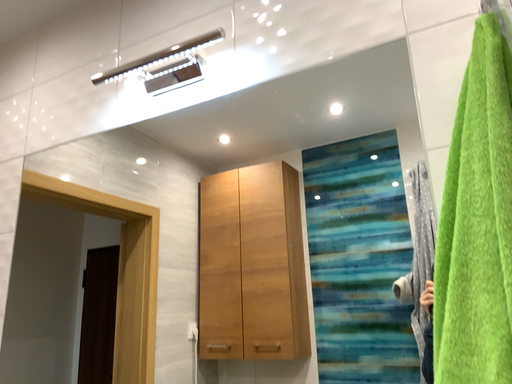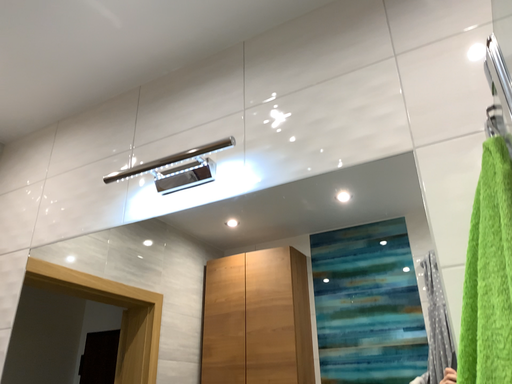
Question: Which way did the camera rotate in the video?

Choices:
 (A) rotated upward
 (B) rotated downward

Answer: (A)